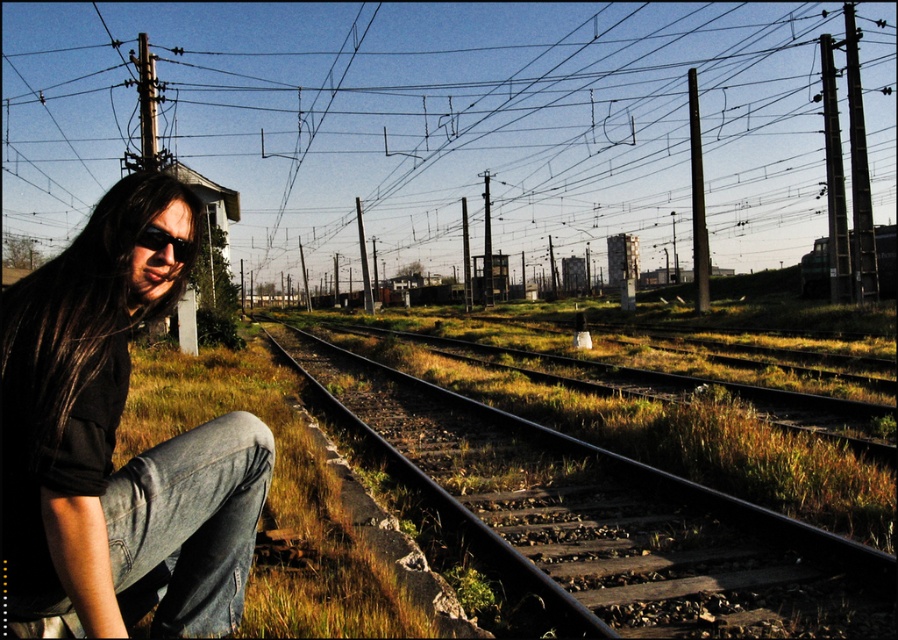
You are a photographer setting up a shot at the railway tracks. You notice the metallic wire at upper center and denim jeans at left. Which object is positioned higher in the image?

The metallic wire at upper center is taller than denim jeans at left, so the metallic wire at upper center is positioned higher in the image.

Based on the scene description, where is the brown matte hair at left located in terms of coordinates?

The brown matte hair at left is located at coordinates point [84,308].